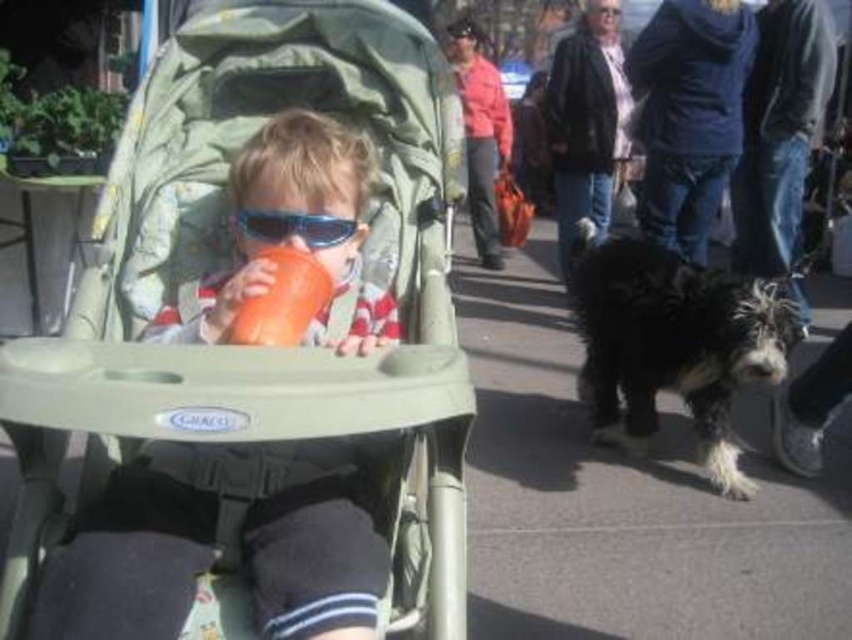
Is point (263, 248) farther from camera compared to point (298, 234)?

No, it is not.

Can you confirm if orange matte cup at center is positioned to the left of blue plastic goggles at center?

Yes, orange matte cup at center is to the left of blue plastic goggles at center.

Who is more distant from viewer, (242, 308) or (291, 212)?

The point (291, 212) is behind.

The height and width of the screenshot is (640, 852). What are the coordinates of `orange matte cup at center` in the screenshot? It's located at (281, 300).

Can you confirm if black shaggy dog at right is positioned to the left of orange matte cup at center?

No, black shaggy dog at right is not to the left of orange matte cup at center.

Does point (666, 288) come farther from viewer compared to point (239, 321)?

Yes, point (666, 288) is farther from viewer.

Identify the location of black shaggy dog at right. The image size is (852, 640). point(672,344).

Which of these two, matte green stroller at center or blue plastic goggles at center, stands shorter?

Standing shorter between the two is blue plastic goggles at center.

Does matte green stroller at center have a greater width compared to blue plastic goggles at center?

Correct, the width of matte green stroller at center exceeds that of blue plastic goggles at center.

Does point (222, 540) come farther from viewer compared to point (279, 240)?

No, it is not.

Where is `matte green stroller at center`? The image size is (852, 640). matte green stroller at center is located at coordinates (252, 356).